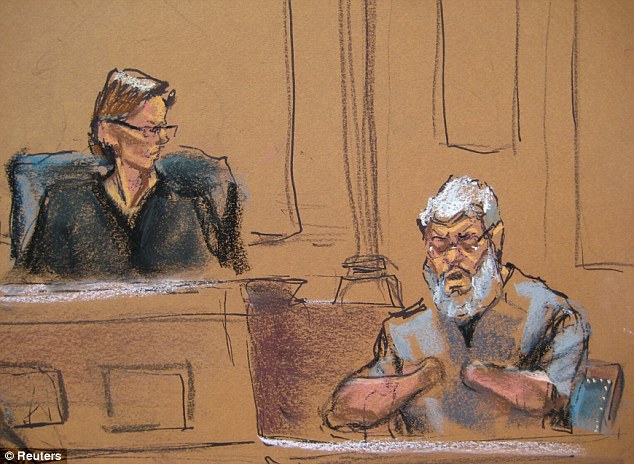
The width and height of the screenshot is (634, 464). What are the coordinates of `black chair` in the screenshot? It's located at (16, 184).